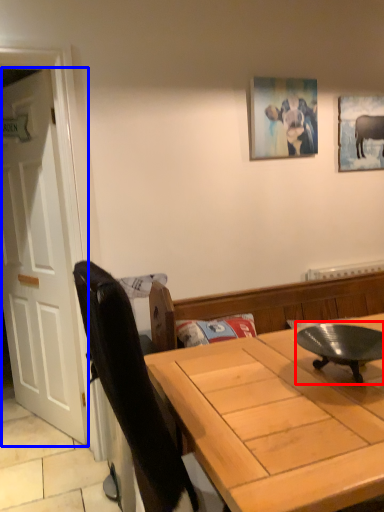
Question: Which of the following is the farthest to the observer, round table (highlighted by a red box) or door (highlighted by a blue box)?

Choices:
 (A) round table
 (B) door

Answer: (B)